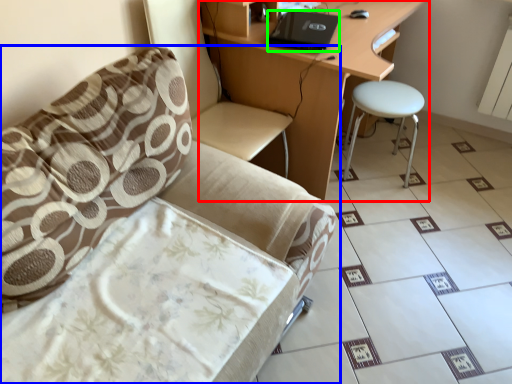
Question: Estimate the real-world distances between objects in this image. Which object is farther from desk (highlighted by a red box), chair (highlighted by a blue box) or laptop (highlighted by a green box)?

Choices:
 (A) chair
 (B) laptop

Answer: (A)